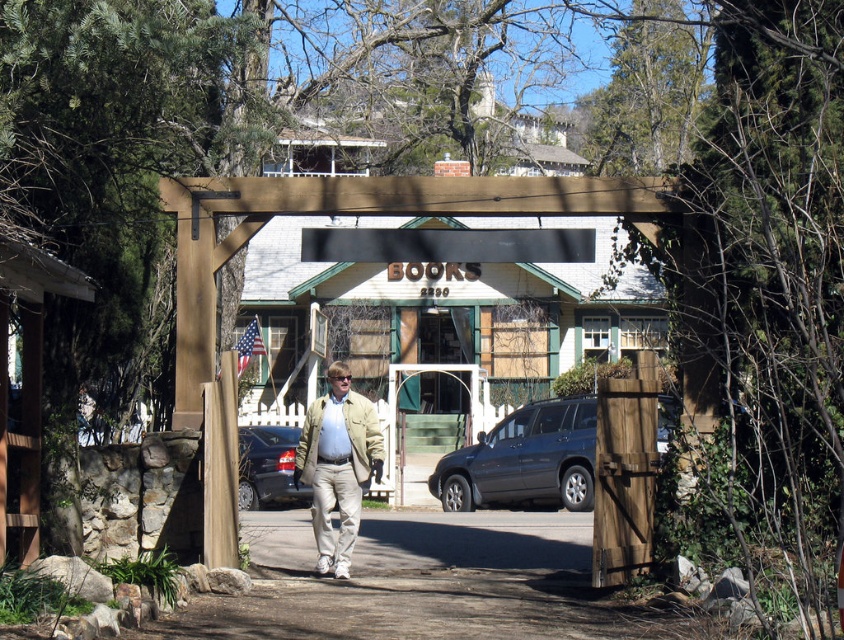
Question: Which object is positioned farthest from the shiny dark blue sedan at center?

Choices:
 (A) matte dark blue suv at center
 (B) gray asphalt pavement at center

Answer: (B)

Question: Where is gray asphalt pavement at center located in relation to shiny dark blue sedan at center in the image?

Choices:
 (A) left
 (B) right

Answer: (B)

Question: Which object is the closest to the gray asphalt pavement at center?

Choices:
 (A) shiny dark blue sedan at center
 (B) tan fabric jacket at center
 (C) matte dark blue suv at center

Answer: (C)

Question: Does gray asphalt pavement at center have a lesser width compared to tan fabric jacket at center?

Choices:
 (A) yes
 (B) no

Answer: (B)

Question: Which point is farther to the camera?

Choices:
 (A) matte dark blue suv at center
 (B) tan fabric jacket at center
 (C) gray asphalt pavement at center
 (D) shiny dark blue sedan at center

Answer: (D)

Question: Is gray asphalt pavement at center thinner than matte dark blue suv at center?

Choices:
 (A) no
 (B) yes

Answer: (A)